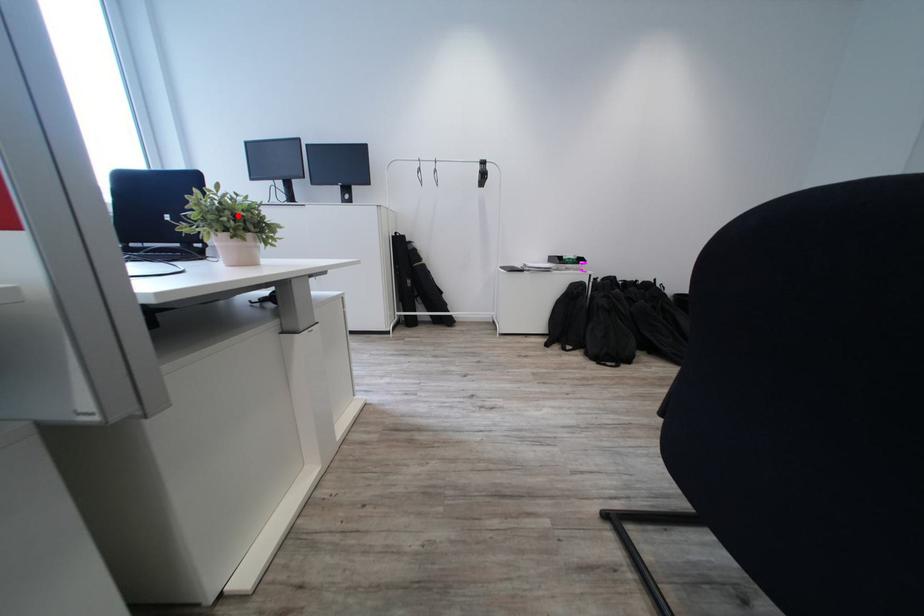
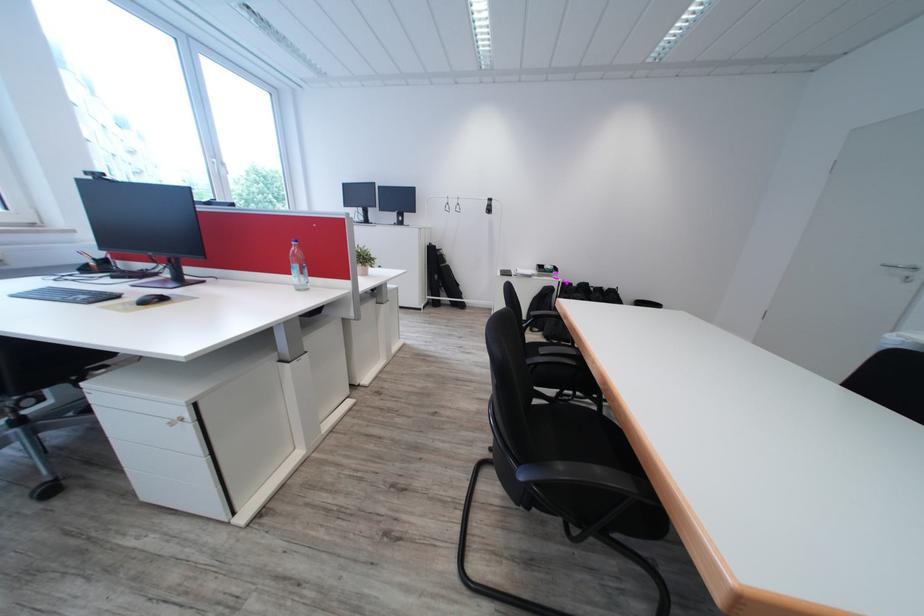
Question: I am providing you with two images of the same scene from different viewpoints. In image1, a red point is highlighted. Considering the same 3D point in image2, which of the following is correct?

Choices:
 (A) It is closer
 (B) It is farther

Answer: (A)